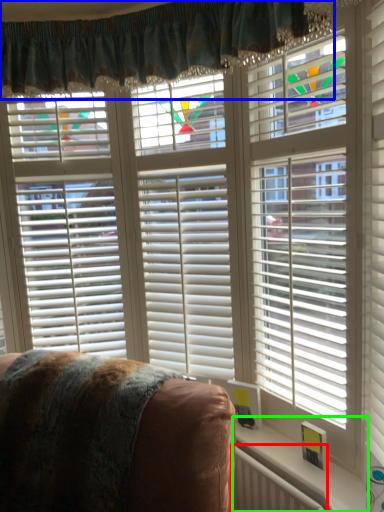
Question: Which is nearer to the radiator (highlighted by a red box)? curtain (highlighted by a blue box) or window sill (highlighted by a green box).

Choices:
 (A) curtain
 (B) window sill

Answer: (B)